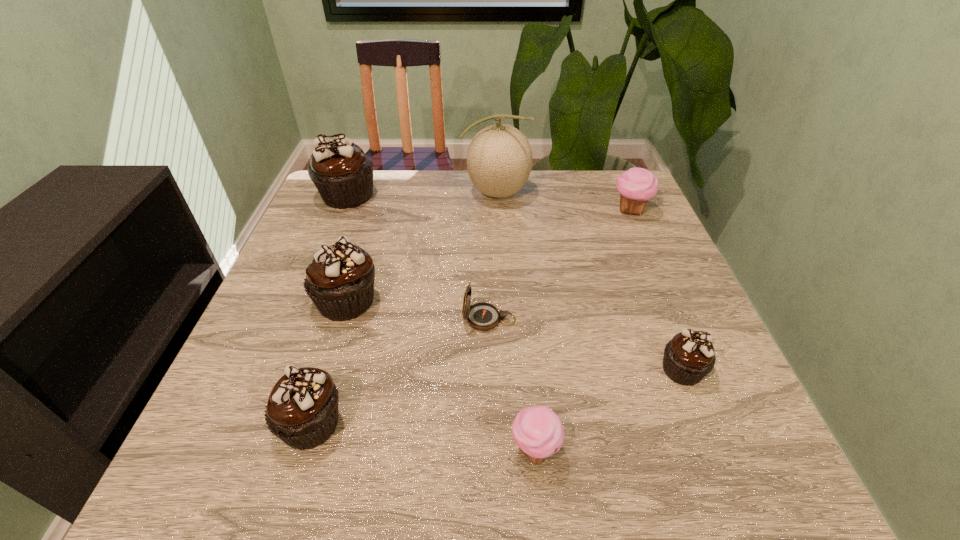
Find the location of `vacant area that lies between the smaller pink cupcake and the bigger pink cupcake`. vacant area that lies between the smaller pink cupcake and the bigger pink cupcake is located at coordinates (583, 330).

Where is `unoccupied position between the smallest brown cupcake and the farthest brown cupcake`? unoccupied position between the smallest brown cupcake and the farthest brown cupcake is located at coordinates (515, 283).

Identify the location of vacant area that lies between the nearer pink cupcake and the nearest brown cupcake. (422, 436).

Identify which object is the second nearest to the second tallest object. Please provide its 2D coordinates. Your answer should be formatted as a tuple, i.e. [(x, y)], where the tuple contains the x and y coordinates of a point satisfying the conditions above.

[(339, 280)]

The height and width of the screenshot is (540, 960). Identify the location of object that ranks as the third closest to the third smallest brown cupcake. (343, 175).

The width and height of the screenshot is (960, 540). In order to click on the fourth closest cupcake relative to the nearest brown cupcake in this screenshot , I will do `click(689, 356)`.

The height and width of the screenshot is (540, 960). I want to click on the fifth closest cupcake relative to the right pink cupcake, so click(302, 409).

Locate which brown cupcake ranks in proximity to the seventh shortest object. Please provide its 2D coordinates. Your answer should be formatted as a tuple, i.e. [(x, y)], where the tuple contains the x and y coordinates of a point satisfying the conditions above.

[(339, 280)]

Identify which brown cupcake is located as the nearest to the tallest object. Please provide its 2D coordinates. Your answer should be formatted as a tuple, i.e. [(x, y)], where the tuple contains the x and y coordinates of a point satisfying the conditions above.

[(343, 175)]

You are a GUI agent. You are given a task and a screenshot of the screen. Output one action in this format:
    pyautogui.click(x=<x>, y=<y>)
    Task: Click on the free space that satisfies the following two spatial constraints: 1. on the face of the left pink cupcake; 2. on the right side of the compass
    
    Given the screenshot: What is the action you would take?
    pyautogui.click(x=492, y=449)